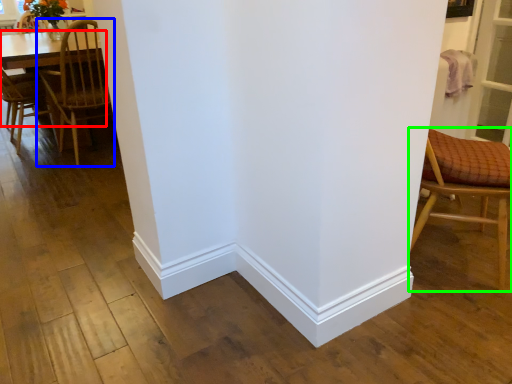
Question: Estimate the real-world distances between objects in this image. Which object is closer to table (highlighted by a red box), chair (highlighted by a blue box) or chair (highlighted by a green box)?

Choices:
 (A) chair
 (B) chair

Answer: (A)